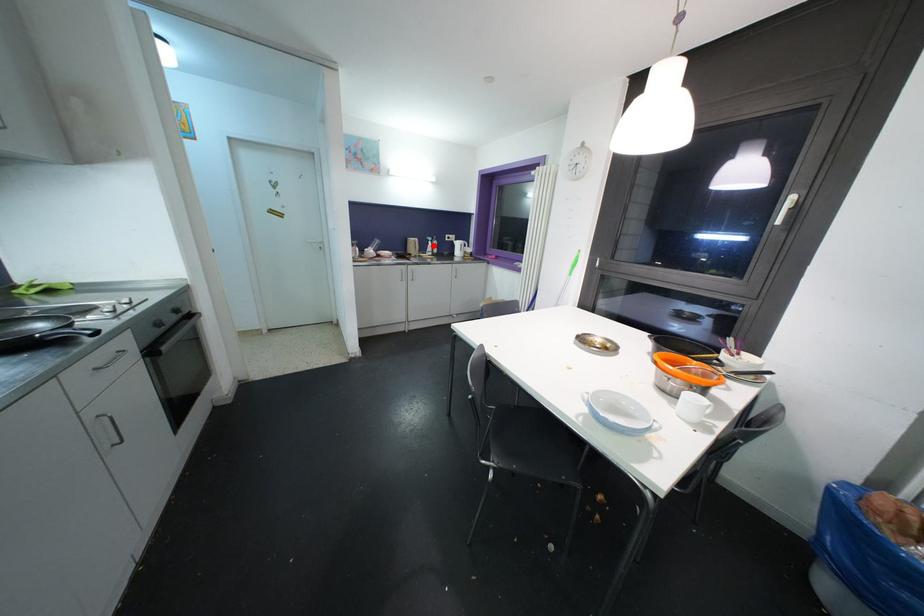
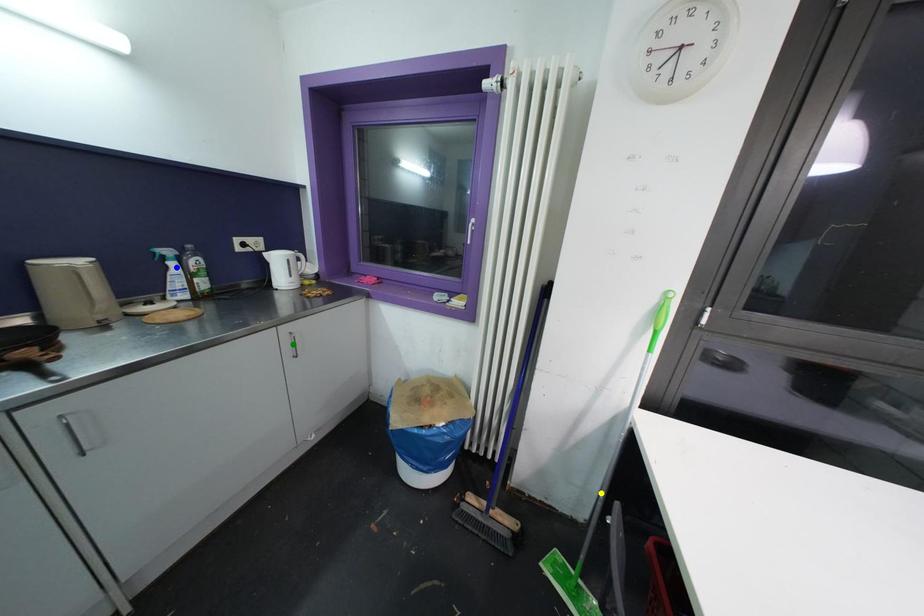
Question: I am providing you with two images of the same scene from different viewpoints. A red point is marked on the first image. You are given multiple points on the second image. Which point in image 2 represents the same 3d spot as the red point in image 1?

Choices:
 (A) blue point
 (B) yellow point
 (C) green point

Answer: (A)